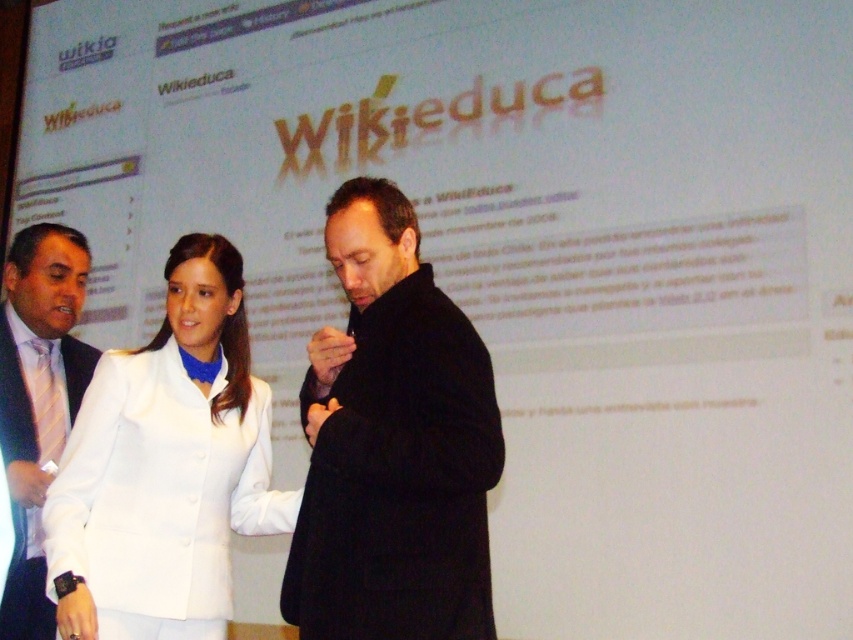
In the scene shown: You are organizing a formal event and need to decide which coat to wear. The black wool coat at center is narrower than the white fabric jacket at center. Which coat has a smaller width?

The black wool coat at center has a smaller width than the white fabric jacket at center.

You are attending a presentation and notice two items in the scene. The first is a black wool coat at center, and the second is a white shirt at left. Which item is shorter in height?

The black wool coat at center is shorter in height than the white shirt at left.

You are standing in front of the Wikieduca screen and want to touch the white fabric jacket at center. What are the coordinates where you should aim your hand?

The coordinates to aim your hand are at point (166, 465).